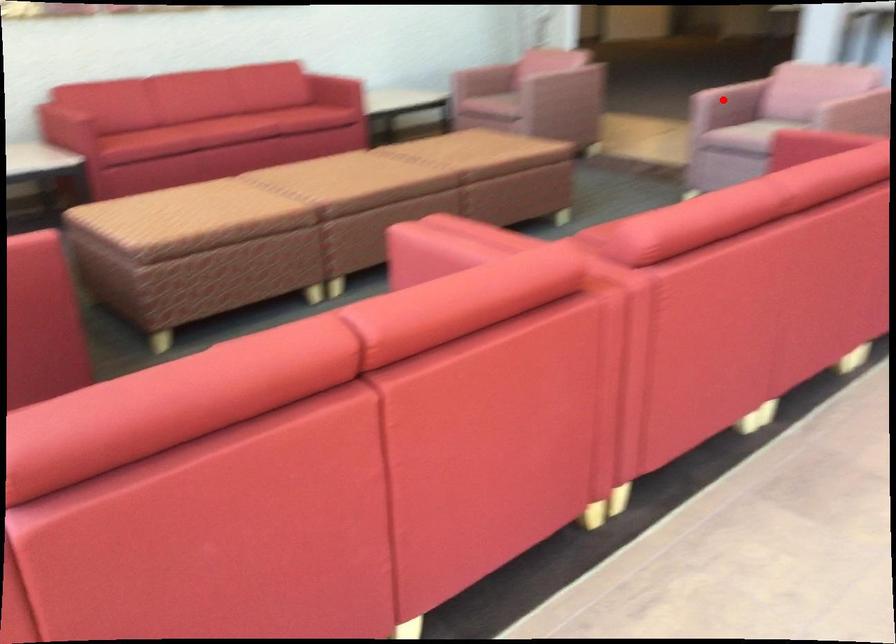
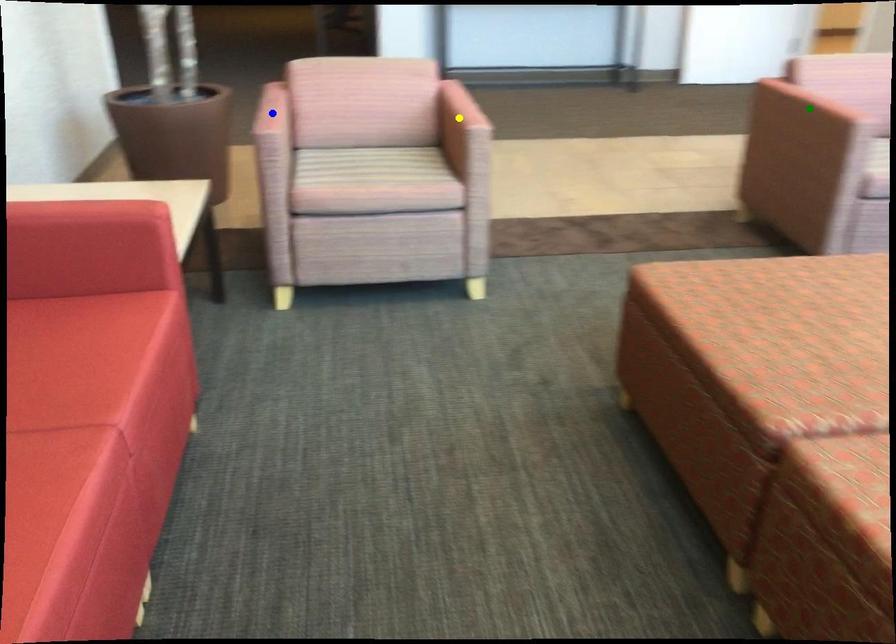
Question: I am providing you with two images of the same scene from different viewpoints. A red point is marked on the first image. You are given multiple points on the second image. Which point in image 2 is actually the same real-world point as the red point in image 1?

Choices:
 (A) green point
 (B) yellow point
 (C) blue point

Answer: (A)